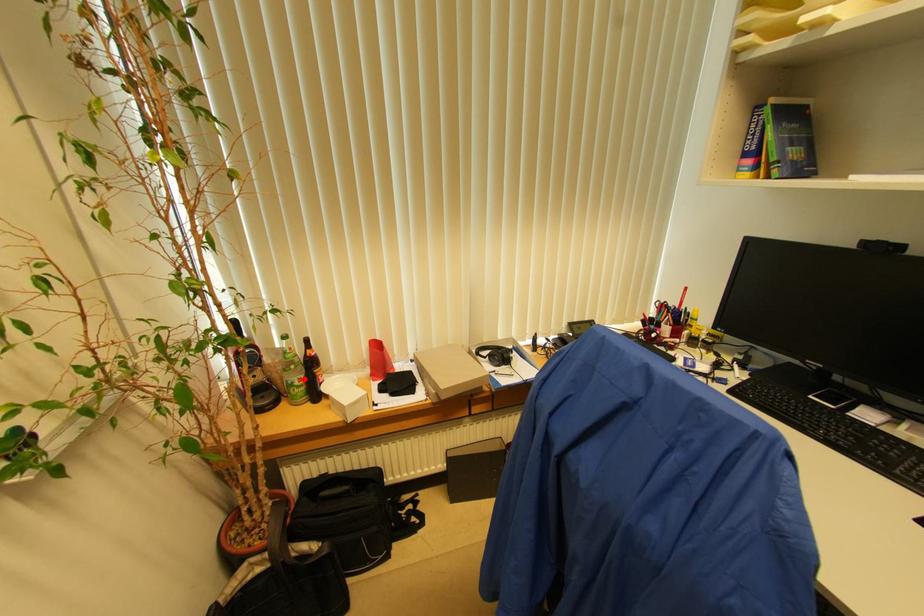
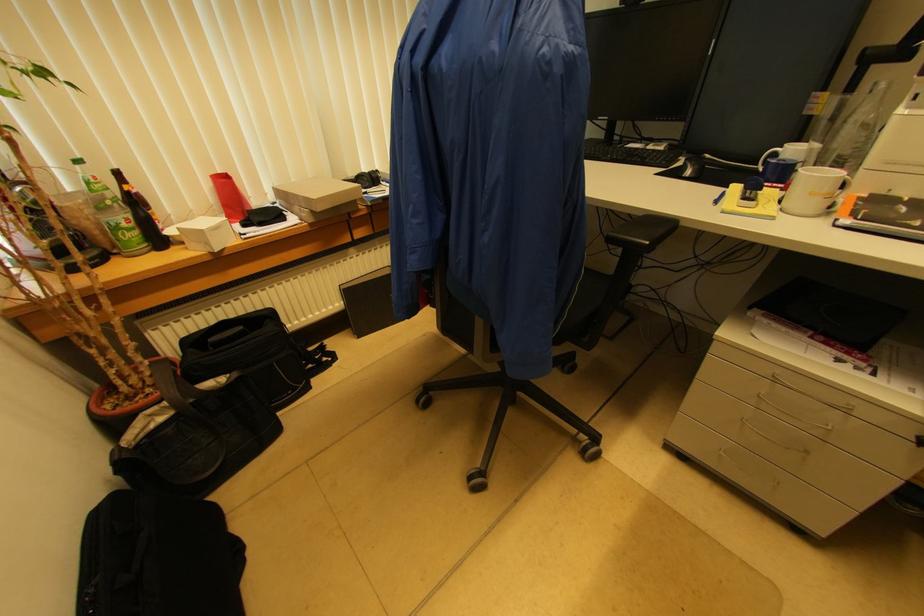
Locate, in the second image, the point that corresponds to the highlighted location in the first image.

(131, 219)